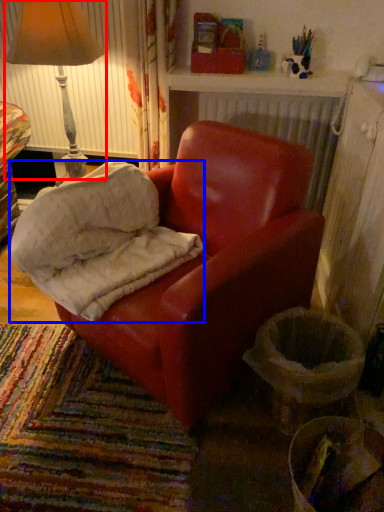
Question: Which point is further to the camera, lamp (highlighted by a red box) or material (highlighted by a blue box)?

Choices:
 (A) lamp
 (B) material

Answer: (A)